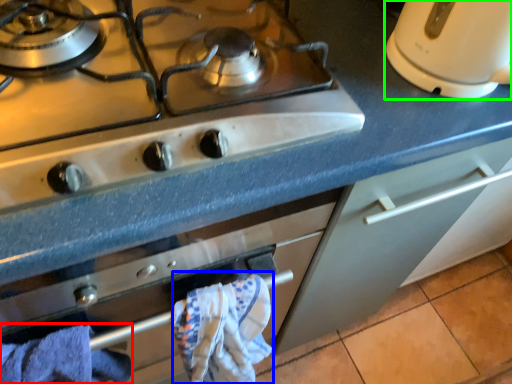
Question: Estimate the real-world distances between objects in this image. Which object is closer to bath towel (highlighted by a red box), bath towel (highlighted by a blue box) or kitchen appliance (highlighted by a green box)?

Choices:
 (A) bath towel
 (B) kitchen appliance

Answer: (A)